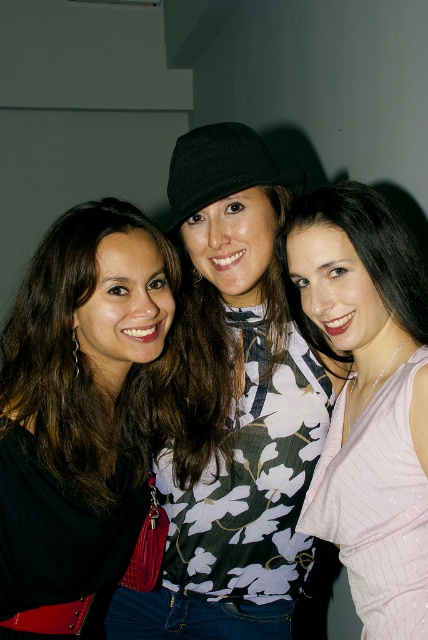
Question: Does floral-patterned blouse at center have a smaller size compared to black leather purse at left?

Choices:
 (A) no
 (B) yes

Answer: (A)

Question: Among these points, which one is nearest to the camera?

Choices:
 (A) (300, 192)
 (B) (133, 396)
 (C) (300, 307)

Answer: (A)

Question: Can you confirm if floral-patterned blouse at center is bigger than pink ribbed tank top at center?

Choices:
 (A) no
 (B) yes

Answer: (B)

Question: Which of the following is the farthest from the observer?

Choices:
 (A) pink ribbed tank top at center
 (B) black leather purse at left

Answer: (B)

Question: Is floral-patterned blouse at center below black leather purse at left?

Choices:
 (A) yes
 (B) no

Answer: (B)

Question: Which of these objects is positioned farthest from the floral-patterned blouse at center?

Choices:
 (A) pink ribbed tank top at center
 (B) black leather purse at left

Answer: (B)